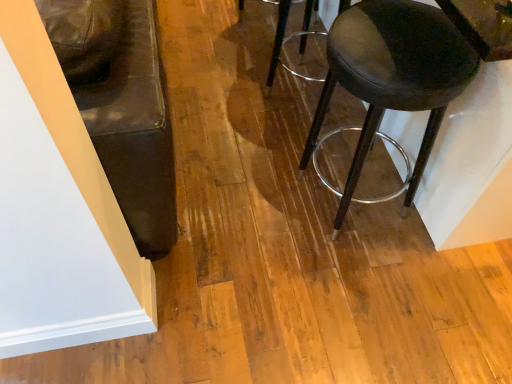
The image size is (512, 384). Identify the location of free spot behind transparent plastic stool at center, which is the 1th stool in top-to-bottom order. (285, 62).